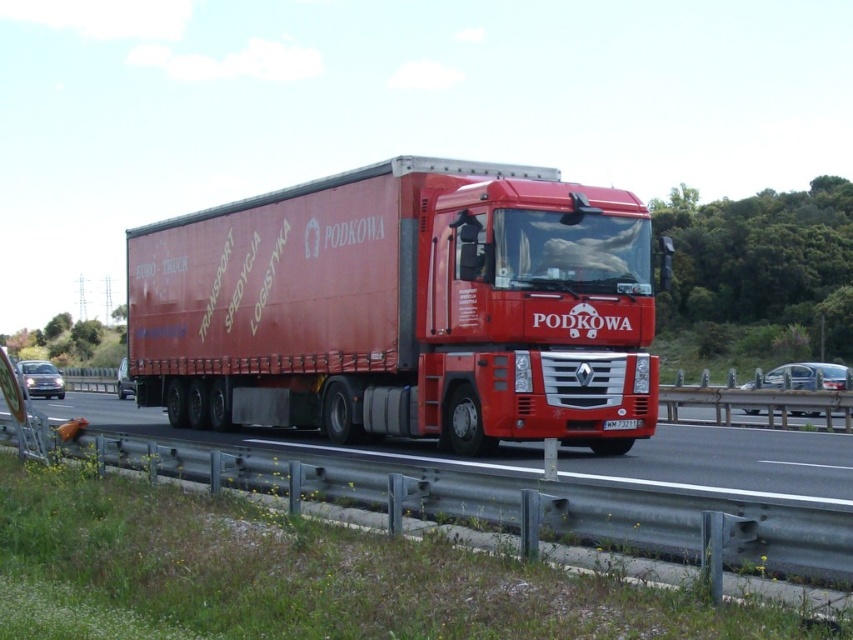
Which is more to the right, matte red trailer truck at center or metallic highway at lower left?

matte red trailer truck at center

Who is taller, matte red trailer truck at center or metallic highway at lower left?

Standing taller between the two is matte red trailer truck at center.

What do you see at coordinates (402, 308) in the screenshot? I see `matte red trailer truck at center` at bounding box center [402, 308].

Identify the location of matte red trailer truck at center. The height and width of the screenshot is (640, 853). (402, 308).

Is point (238, 218) behind point (613, 420)?

Yes, point (238, 218) is behind point (613, 420).

Locate an element on the screen. The height and width of the screenshot is (640, 853). matte red trailer truck at center is located at coordinates (402, 308).

This screenshot has height=640, width=853. What do you see at coordinates (728, 465) in the screenshot?
I see `metallic highway at lower left` at bounding box center [728, 465].

Which is in front, point (737, 452) or point (625, 426)?

Positioned in front is point (625, 426).

Who is more forward, (450, 456) or (631, 424)?

Positioned in front is point (631, 424).

The width and height of the screenshot is (853, 640). Identify the location of metallic highway at lower left. (728, 465).